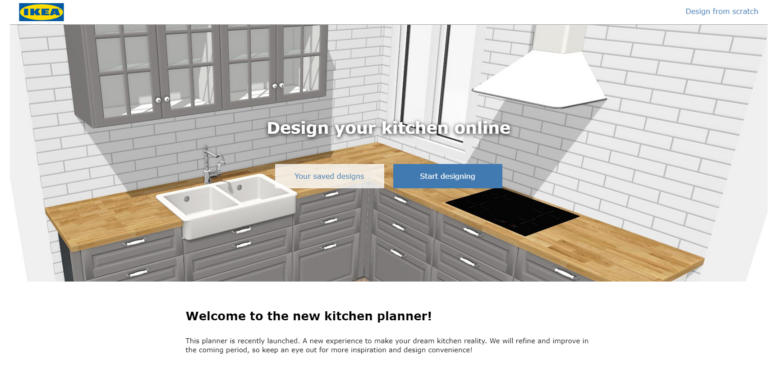
Locate an element on the screen. The width and height of the screenshot is (768, 382). shadow cast by vent hood is located at coordinates (518, 149).